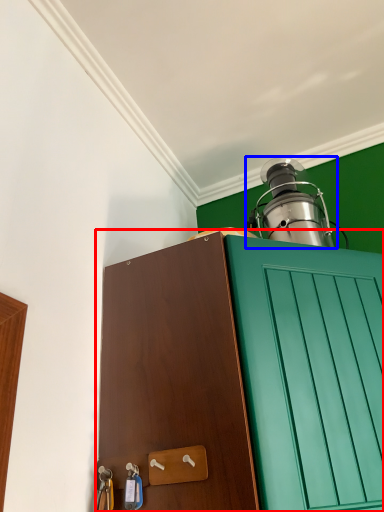
Question: Which object is further to the camera taking this photo, cabinetry (highlighted by a red box) or oil lamp (highlighted by a blue box)?

Choices:
 (A) cabinetry
 (B) oil lamp

Answer: (B)